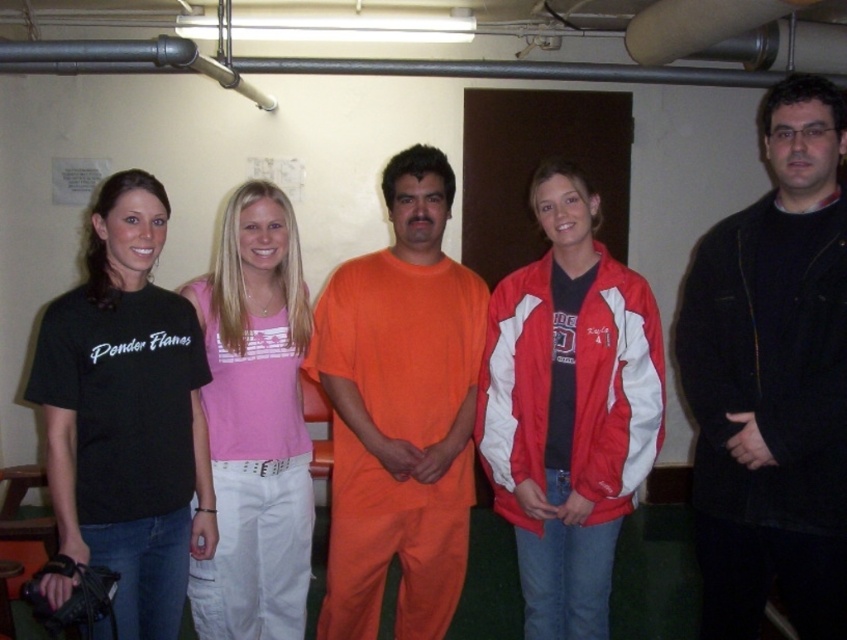
Question: Can you confirm if black matte jacket at center is smaller than red and white jacket at center?

Choices:
 (A) no
 (B) yes

Answer: (A)

Question: Which object is farther from the camera taking this photo?

Choices:
 (A) orange matte uniform at center
 (B) pink fabric tank top at center

Answer: (A)

Question: In this image, where is orange matte uniform at center located relative to black cotton t-shirt at left?

Choices:
 (A) right
 (B) left

Answer: (A)

Question: Which point appears closest to the camera in this image?

Choices:
 (A) (198, 380)
 (B) (619, 358)
 (C) (382, 429)

Answer: (B)

Question: Which object is the farthest from the pink fabric tank top at center?

Choices:
 (A) orange matte uniform at center
 (B) black cotton t-shirt at left

Answer: (A)

Question: Is black matte jacket at center closer to the viewer compared to black cotton t-shirt at left?

Choices:
 (A) yes
 (B) no

Answer: (B)